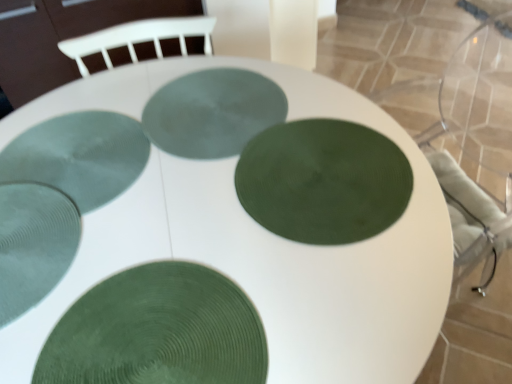
I want to click on free spot behind green textured plate at center, which appears as the first glass plate when viewed from the front, so click(x=163, y=210).